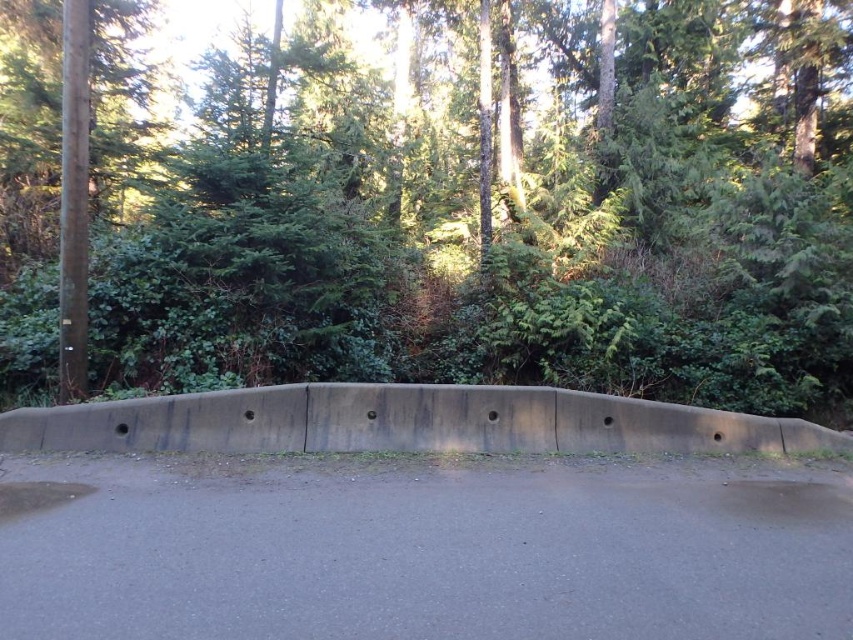
Question: Can you confirm if green leafy forest at upper center is thinner than gray concrete barrier at center?

Choices:
 (A) yes
 (B) no

Answer: (B)

Question: Is green leafy forest at upper center smaller than gray concrete barrier at center?

Choices:
 (A) no
 (B) yes

Answer: (A)

Question: Which of the following is the closest to the observer?

Choices:
 (A) (453, 291)
 (B) (520, 410)

Answer: (B)

Question: Which of the following is the farthest from the observer?

Choices:
 (A) (680, 17)
 (B) (538, 413)

Answer: (A)

Question: Among these points, which one is nearest to the camera?

Choices:
 (A) (547, 225)
 (B) (838, 435)

Answer: (B)

Question: Is green leafy forest at upper center wider than gray concrete barrier at center?

Choices:
 (A) yes
 (B) no

Answer: (A)